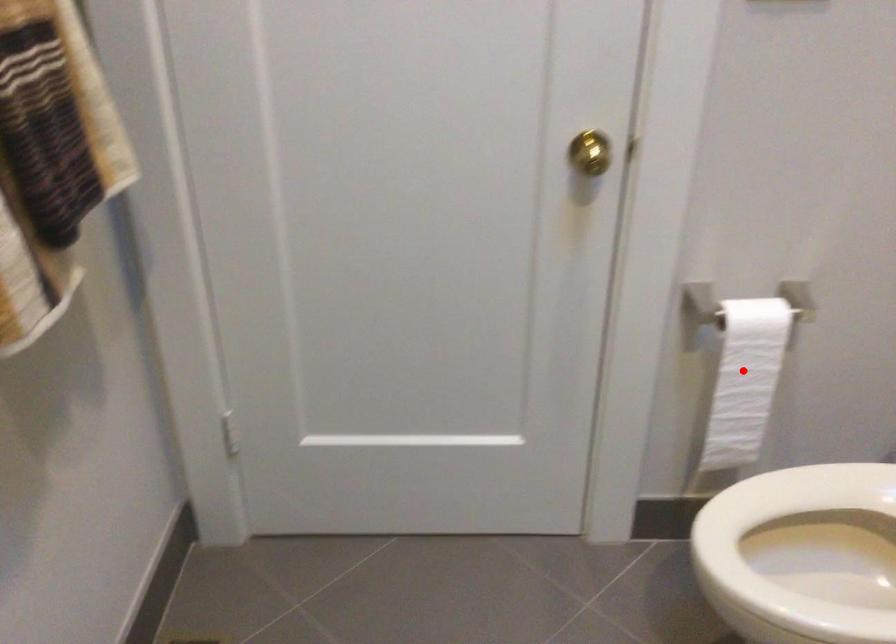
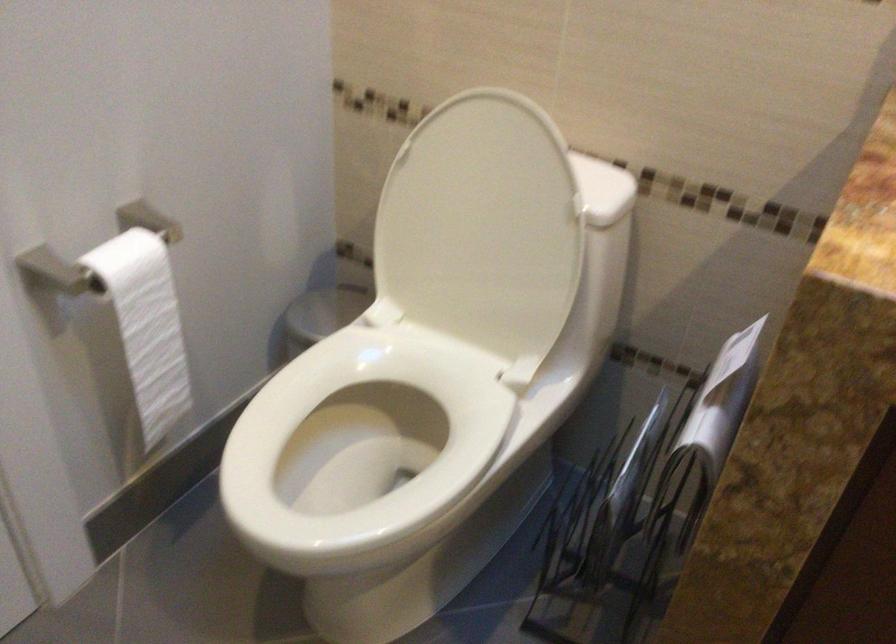
Locate, in the second image, the point that corresponds to the highlighted location in the first image.

(147, 325)